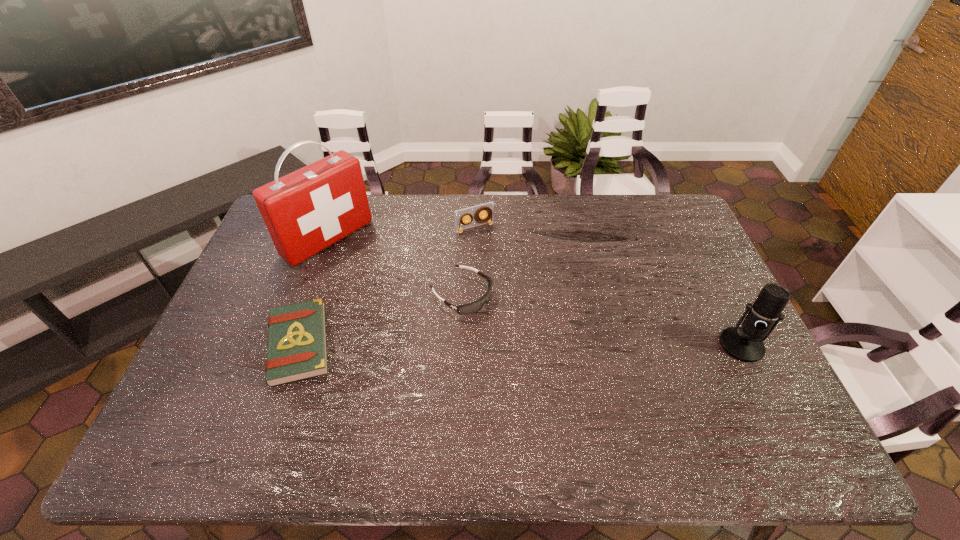
Find the location of a particular element. This screenshot has width=960, height=540. book that is at the left edge is located at coordinates (297, 346).

This screenshot has height=540, width=960. I want to click on the first-aid kit located in the left edge section of the desktop, so click(x=306, y=211).

The height and width of the screenshot is (540, 960). I want to click on object present at the right edge, so click(x=745, y=343).

At what (x,y) coordinates should I click in order to perform the action: click on object present at the far left corner. Please return your answer as a coordinate pair (x, y). Looking at the image, I should click on (306, 211).

The image size is (960, 540). In order to click on object present at the near left corner in this screenshot , I will do `click(297, 346)`.

The height and width of the screenshot is (540, 960). In the image, there is a desktop. What are the coordinates of `blank space at the far edge` in the screenshot? It's located at (407, 204).

Find the location of `free space at the near edge of the desktop`. free space at the near edge of the desktop is located at coordinates (331, 413).

The width and height of the screenshot is (960, 540). I want to click on vacant space at the left edge, so click(251, 360).

Identify the location of free space at the right edge of the desktop. This screenshot has height=540, width=960. (673, 275).

Locate an element on the screen. The width and height of the screenshot is (960, 540). vacant point at the far right corner is located at coordinates (667, 220).